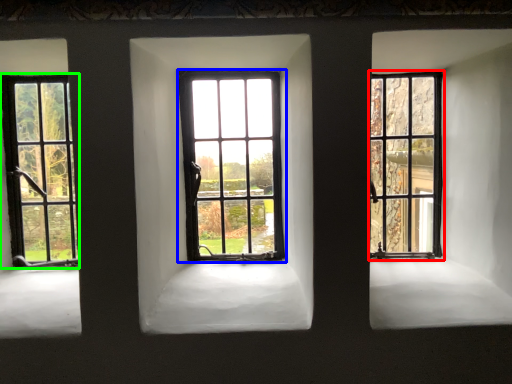
Question: Which is nearer to the window (highlighted by a red box)? window (highlighted by a blue box) or window (highlighted by a green box).

Choices:
 (A) window
 (B) window

Answer: (A)